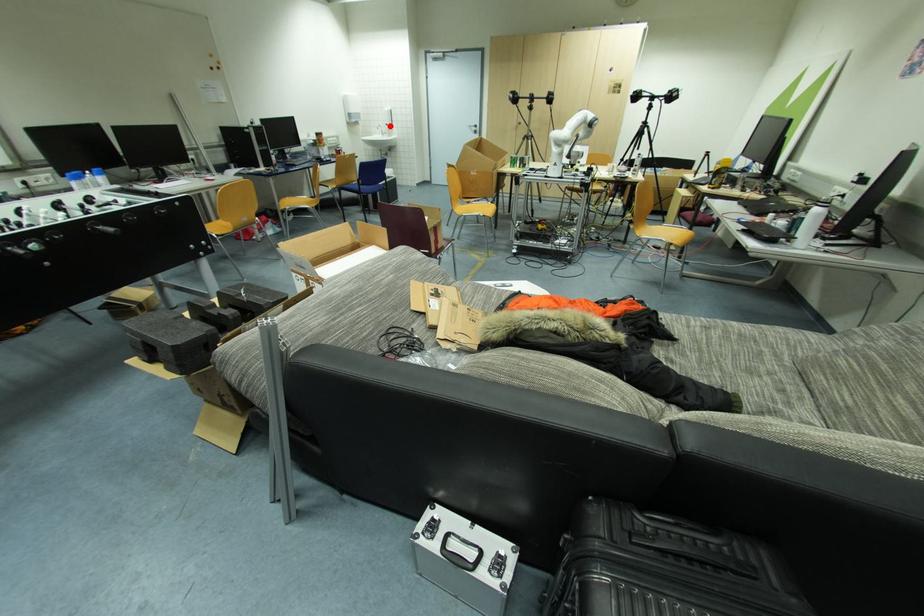
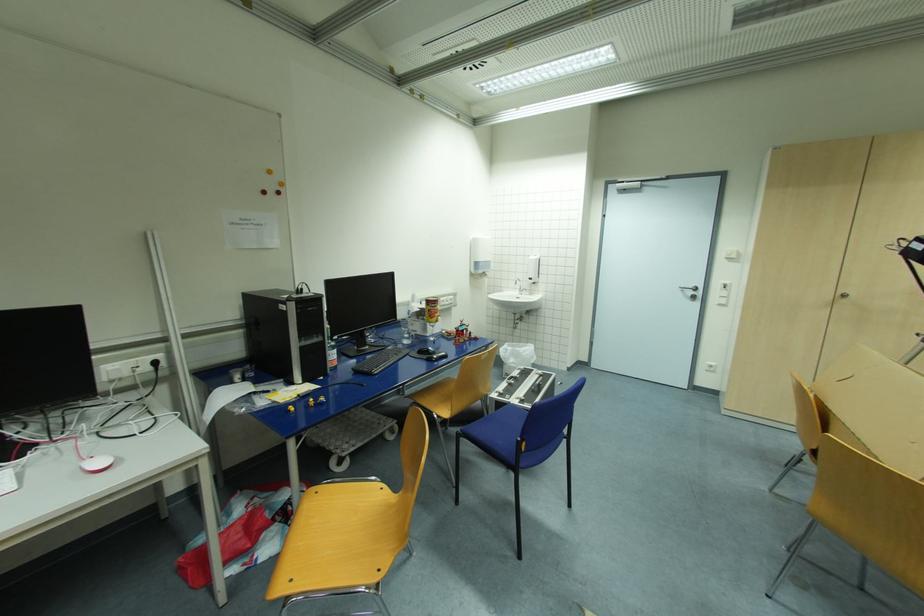
Locate, in the second image, the point that corresponds to the highlighted location in the first image.

(533, 280)